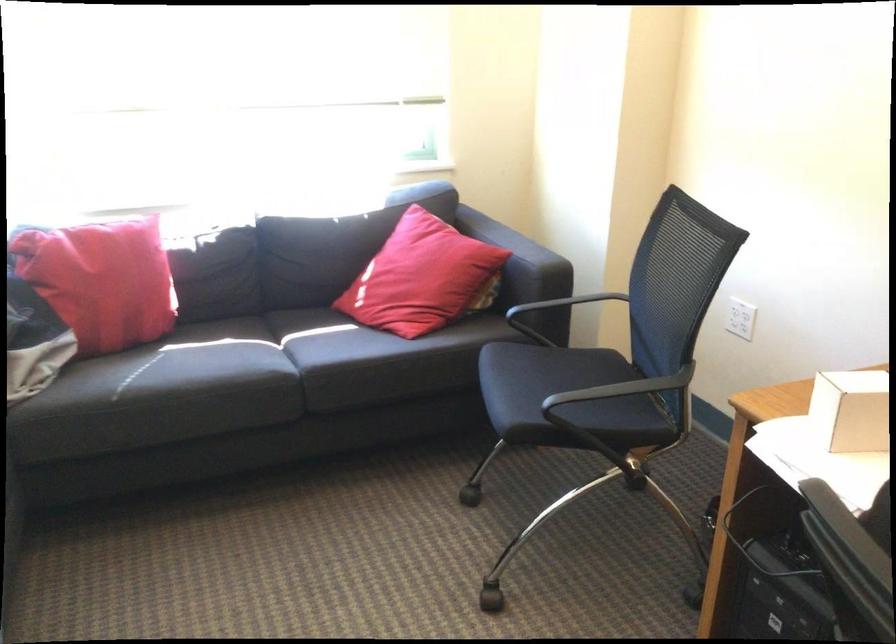
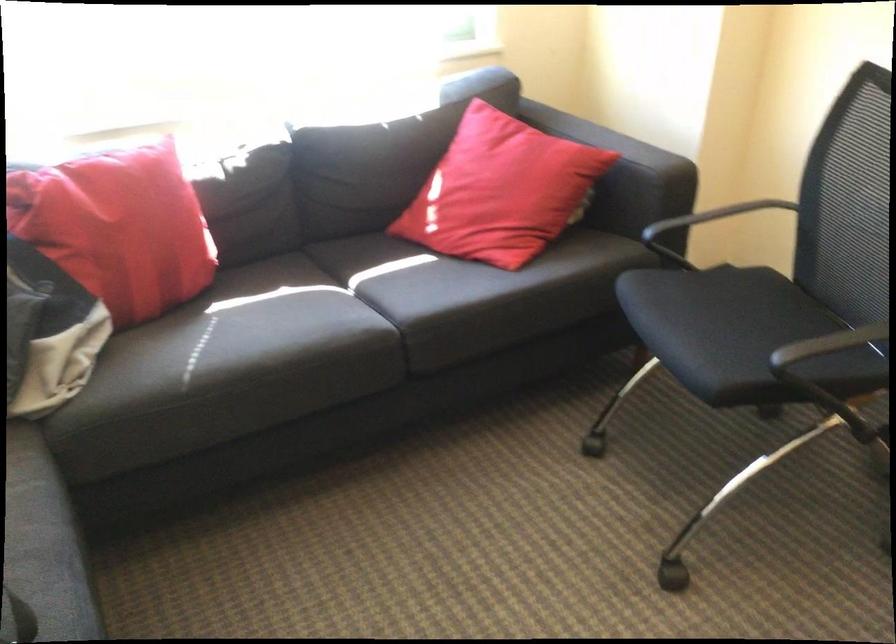
Where in the second image is the point corresponding to (x=519, y=240) from the first image?

(616, 140)